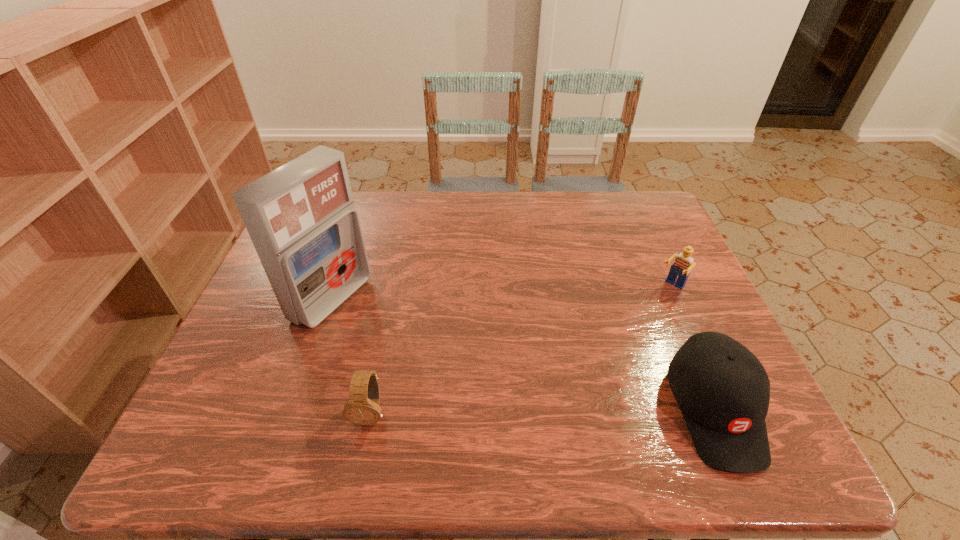
At what (x,y) coordinates should I click in order to perform the action: click on vacant area at the right edge. Please return your answer as a coordinate pair (x, y). Looking at the image, I should click on (679, 334).

Locate an element on the screen. This screenshot has width=960, height=540. free area in between the baseball cap and the first-aid kit is located at coordinates (523, 354).

Image resolution: width=960 pixels, height=540 pixels. I want to click on blank region between the baseball cap and the watch, so click(542, 411).

Identify the location of free space between the baseball cap and the first-aid kit. The height and width of the screenshot is (540, 960). (523, 354).

Where is `free space between the baseball cap and the third object from right to left`? free space between the baseball cap and the third object from right to left is located at coordinates (542, 411).

Where is `free point between the leftmost object and the third object from right to left`? The width and height of the screenshot is (960, 540). free point between the leftmost object and the third object from right to left is located at coordinates (351, 355).

This screenshot has height=540, width=960. Find the location of `vacant point located between the second object from left to right and the leftmost object`. vacant point located between the second object from left to right and the leftmost object is located at coordinates (351, 355).

Where is `vacant space that is in between the tallest object and the second object from left to right`? The image size is (960, 540). vacant space that is in between the tallest object and the second object from left to right is located at coordinates (351, 355).

You are a GUI agent. You are given a task and a screenshot of the screen. Output one action in this format:
    pyautogui.click(x=<x>, y=<y>)
    Task: Click on the free area in between the tallest object and the watch
    
    Given the screenshot: What is the action you would take?
    pyautogui.click(x=351, y=355)

Find the location of a particular element. This screenshot has width=960, height=540. object identified as the second closest to the third object from right to left is located at coordinates (723, 391).